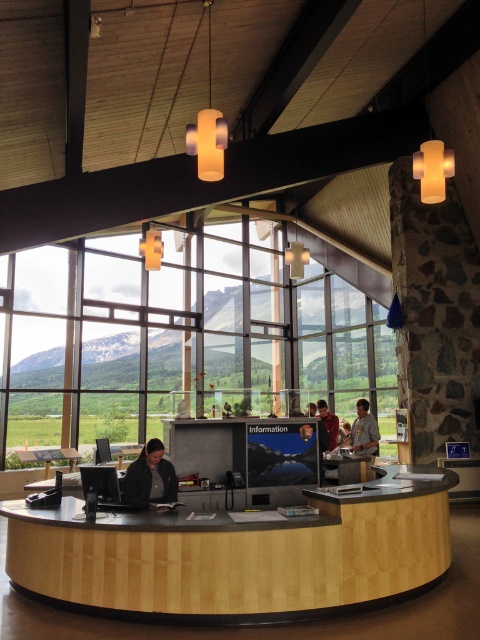
Question: Which point is farther to the camera?

Choices:
 (A) wooden reception desk at center
 (B) light brown leather jacket at center
 (C) matte black monitor at center
 (D) transparent glass window at center

Answer: (D)

Question: Can you confirm if transparent glass window at center is positioned below matte black monitor at center?

Choices:
 (A) yes
 (B) no

Answer: (A)

Question: Among these points, which one is farthest from the camera?

Choices:
 (A) (71, 394)
 (B) (180, 433)
 (C) (289, 618)

Answer: (A)

Question: Is matte black monitor at center bigger than dark gray jacket at center?

Choices:
 (A) yes
 (B) no

Answer: (A)

Question: Which of the following is the closest to the observer?

Choices:
 (A) transparent glass window at center
 (B) matte black monitor at center
 (C) matte red shirt at center
 (D) light brown leather jacket at center

Answer: (B)

Question: Is transparent glass window at center wider than stone textured pillar at right?

Choices:
 (A) yes
 (B) no

Answer: (B)